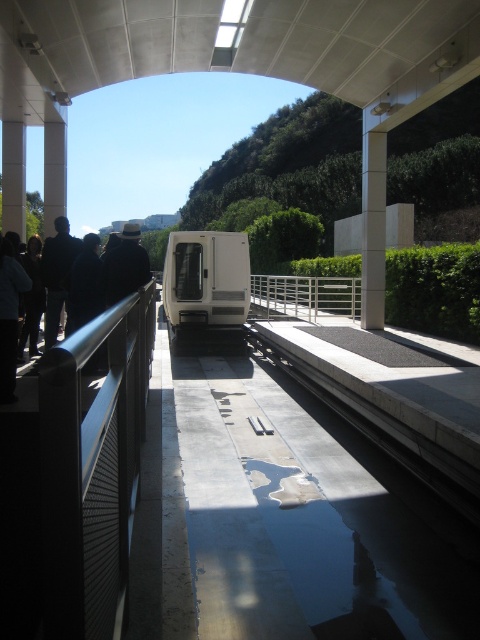
You are a passenger standing on the platform at the transportation station. You see the white matte van at center and the dark blue jacket at left. Which object is higher in elevation?

The white matte van at center is above the dark blue jacket at left, so it is higher in elevation.

You are a passenger waiting at the station and notice a metal mesh railing at left and a dark gray jacket at left. Which object is bigger in size?

The metal mesh railing at left is larger in size than the dark gray jacket at left.